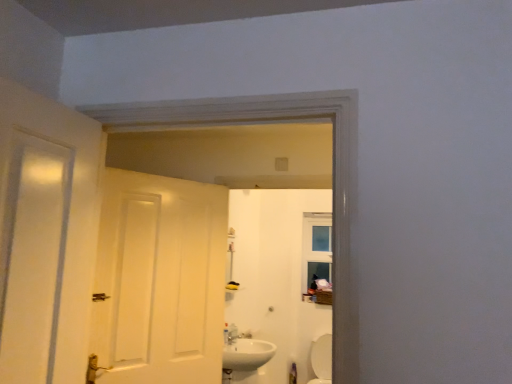
Question: Which is correct: white glossy toilet at lower right is inside white glossy sink at lower center, or outside of it?

Choices:
 (A) inside
 (B) outside

Answer: (B)

Question: From the image's perspective, is white glossy toilet at lower right located above or below white glossy sink at lower center?

Choices:
 (A) below
 (B) above

Answer: (A)

Question: Which object is positioned closest to the white matte door at center?

Choices:
 (A) white glossy mirror at upper center
 (B) white glossy toilet at lower right
 (C) white glossy sink at lower center

Answer: (C)

Question: Which object is the closest to the white glossy sink at lower center?

Choices:
 (A) white matte door at center
 (B) white glossy toilet at lower right
 (C) white glossy mirror at upper center

Answer: (C)